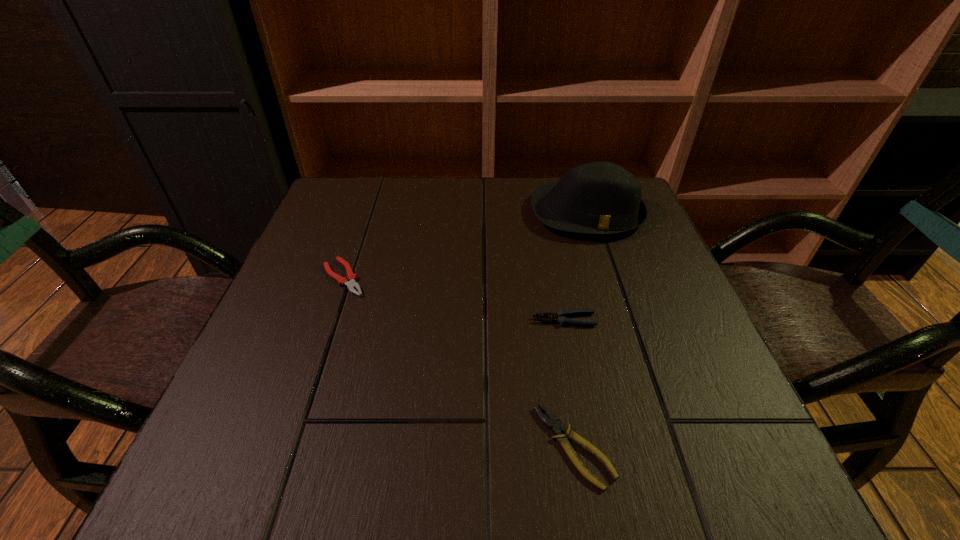
You are a GUI agent. You are given a task and a screenshot of the screen. Output one action in this format:
    pyautogui.click(x=<x>, y=<y>)
    Task: Click on the vacant space at the right edge of the desktop
    
    Given the screenshot: What is the action you would take?
    pyautogui.click(x=703, y=334)

Identify the location of free space at the far left corner of the desktop. The height and width of the screenshot is (540, 960). (330, 193).

In the image, there is a desktop. Where is `free space at the near left corner`? The height and width of the screenshot is (540, 960). free space at the near left corner is located at coordinates (254, 457).

Locate an element on the screen. vacant space that's between the nearest pliers and the third shortest object is located at coordinates (569, 383).

Where is `vacant area that lies between the nearest pliers and the third farthest object`? The width and height of the screenshot is (960, 540). vacant area that lies between the nearest pliers and the third farthest object is located at coordinates (569, 383).

The height and width of the screenshot is (540, 960). I want to click on vacant area between the third nearest object and the tallest pliers, so click(454, 299).

The width and height of the screenshot is (960, 540). In order to click on free area in between the second tallest object and the fedora in this screenshot , I will do `click(575, 266)`.

This screenshot has height=540, width=960. I want to click on free spot between the third shortest object and the fedora, so click(x=575, y=266).

The width and height of the screenshot is (960, 540). What are the coordinates of `free spot between the leftmost pliers and the second farthest pliers` in the screenshot? It's located at (454, 299).

Find the location of a particular element. This screenshot has height=540, width=960. vacant region between the leftmost pliers and the tallest object is located at coordinates (466, 245).